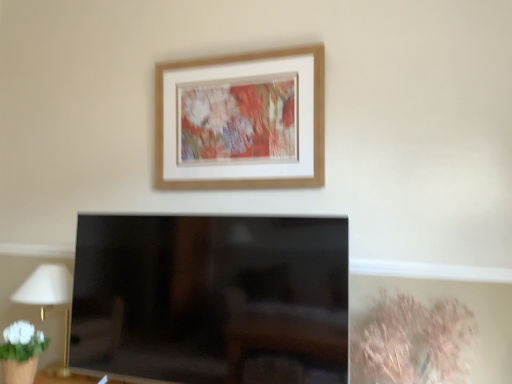
Locate an element on the screen. white fabric lampshade at left is located at coordinates [45, 287].

What do you see at coordinates (241, 121) in the screenshot? The height and width of the screenshot is (384, 512). I see `wooden picture frame at upper center` at bounding box center [241, 121].

Where is `dry grass at lower right`? dry grass at lower right is located at coordinates (412, 342).

Where is `white fabric lampshade at left`? The width and height of the screenshot is (512, 384). white fabric lampshade at left is located at coordinates (45, 287).

Is dry grass at lower right positioned beyond the bounds of wooden picture frame at upper center?

Yes.

The image size is (512, 384). I want to click on plant in front of the wooden picture frame at upper center, so pos(412,342).

Is dry grass at lower right beside wooden picture frame at upper center?

They are not placed beside each other.

Does dry grass at lower right come in front of wooden picture frame at upper center?

Yes, dry grass at lower right is closer to the viewer.

Considering the points (398, 307) and (52, 295), which point is behind, point (398, 307) or point (52, 295)?

The point (52, 295) is farther from the camera.

Considering the sizes of dry grass at lower right and white fabric lampshade at left in the image, is dry grass at lower right wider or thinner than white fabric lampshade at left?

In the image, dry grass at lower right appears to be wider than white fabric lampshade at left.

Is white fabric lampshade at left located within dry grass at lower right?

No, white fabric lampshade at left is not a part of dry grass at lower right.

Is wooden picture frame at upper center wider than dry grass at lower right?

No, wooden picture frame at upper center is not wider than dry grass at lower right.

Is point (196, 151) closer or farther from the camera than point (360, 334)?

Clearly, point (196, 151) is more distant from the camera than point (360, 334).

Does wooden picture frame at upper center touch dry grass at lower right?

No, wooden picture frame at upper center is not in contact with dry grass at lower right.

Does white fabric lampshade at left have a greater width compared to wooden picture frame at upper center?

Yes, white fabric lampshade at left is wider than wooden picture frame at upper center.

Considering the relative sizes of white fabric lampshade at left and wooden picture frame at upper center in the image provided, is white fabric lampshade at left smaller than wooden picture frame at upper center?

No, white fabric lampshade at left is not smaller than wooden picture frame at upper center.

Considering the positions of objects white fabric lampshade at left and wooden picture frame at upper center in the image provided, who is more to the left, white fabric lampshade at left or wooden picture frame at upper center?

white fabric lampshade at left.

From a real-world perspective, is white fabric lampshade at left beneath wooden picture frame at upper center?

Yes.

Does wooden picture frame at upper center have a smaller size compared to white fabric lampshade at left?

Correct, wooden picture frame at upper center occupies less space than white fabric lampshade at left.

Based on the photo, is wooden picture frame at upper center taller than white fabric lampshade at left?

Correct, wooden picture frame at upper center is much taller as white fabric lampshade at left.

Considering the sizes of objects wooden picture frame at upper center and white fabric lampshade at left in the image provided, who is wider, wooden picture frame at upper center or white fabric lampshade at left?

Wider between the two is white fabric lampshade at left.

There is a white fabric lampshade at left. Identify the location of picture frame above it (from a real-world perspective). (241, 121).

Who is shorter, white fabric lampshade at left or dry grass at lower right?

dry grass at lower right is shorter.

Who is smaller, white fabric lampshade at left or dry grass at lower right?

white fabric lampshade at left is smaller.

Can dry grass at lower right be found inside white fabric lampshade at left?

No, dry grass at lower right is not a part of white fabric lampshade at left.

Between white fabric lampshade at left and dry grass at lower right, which one has larger width?

With larger width is dry grass at lower right.

Image resolution: width=512 pixels, height=384 pixels. What are the coordinates of `picture frame above the dry grass at lower right (from a real-world perspective)` in the screenshot? It's located at (241, 121).

This screenshot has height=384, width=512. What are the coordinates of `plant that appears below the white fabric lampshade at left (from a real-world perspective)` in the screenshot? It's located at (412, 342).

Estimate the real-world distances between objects in this image. Which object is closer to dry grass at lower right, wooden picture frame at upper center or white fabric lampshade at left?

Based on the image, wooden picture frame at upper center appears to be nearer to dry grass at lower right.

Which object lies nearer to the anchor point wooden picture frame at upper center, dry grass at lower right or white fabric lampshade at left?

dry grass at lower right.

From the image, which object appears to be nearer to wooden picture frame at upper center, white fabric lampshade at left or dry grass at lower right?

dry grass at lower right lies closer to wooden picture frame at upper center than the other object.

Looking at this image, based on their spatial positions, is white fabric lampshade at left or wooden picture frame at upper center further from dry grass at lower right?

Based on the image, white fabric lampshade at left appears to be further to dry grass at lower right.

Based on the photo, from the image, which object appears to be nearer to white fabric lampshade at left, dry grass at lower right or wooden picture frame at upper center?

Among the two, wooden picture frame at upper center is located nearer to white fabric lampshade at left.

Which object lies further to the anchor point white fabric lampshade at left, wooden picture frame at upper center or dry grass at lower right?

dry grass at lower right is positioned further to the anchor white fabric lampshade at left.

Where is `picture frame situated between white fabric lampshade at left and dry grass at lower right from left to right`? Image resolution: width=512 pixels, height=384 pixels. picture frame situated between white fabric lampshade at left and dry grass at lower right from left to right is located at coordinates (241, 121).